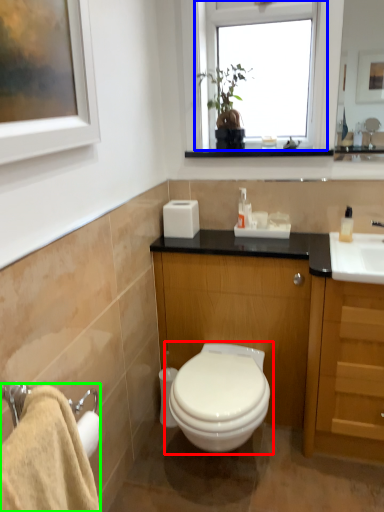
Question: Estimate the real-world distances between objects in this image. Which object is farther from toilet (highlighted by a red box), window (highlighted by a blue box) or bath towel (highlighted by a green box)?

Choices:
 (A) window
 (B) bath towel

Answer: (A)